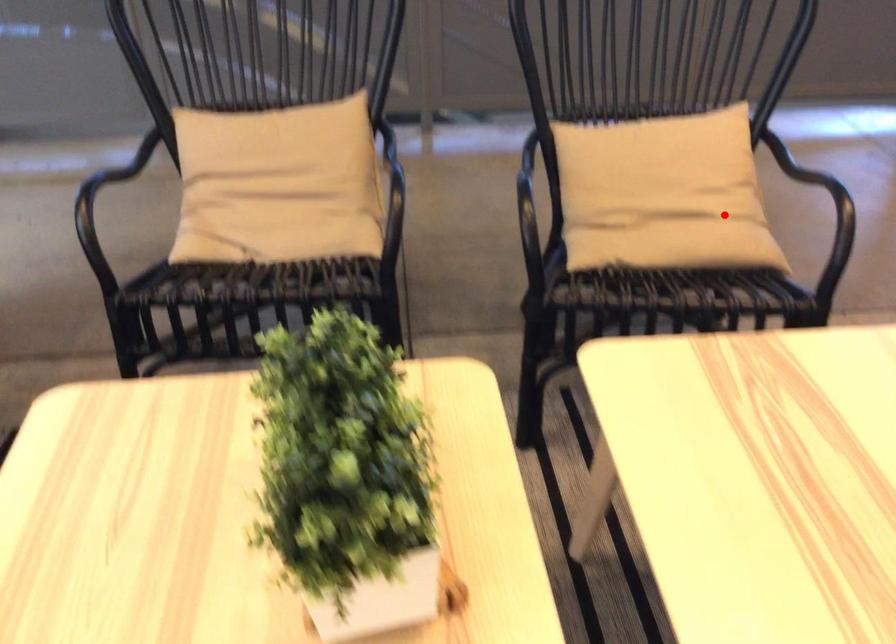
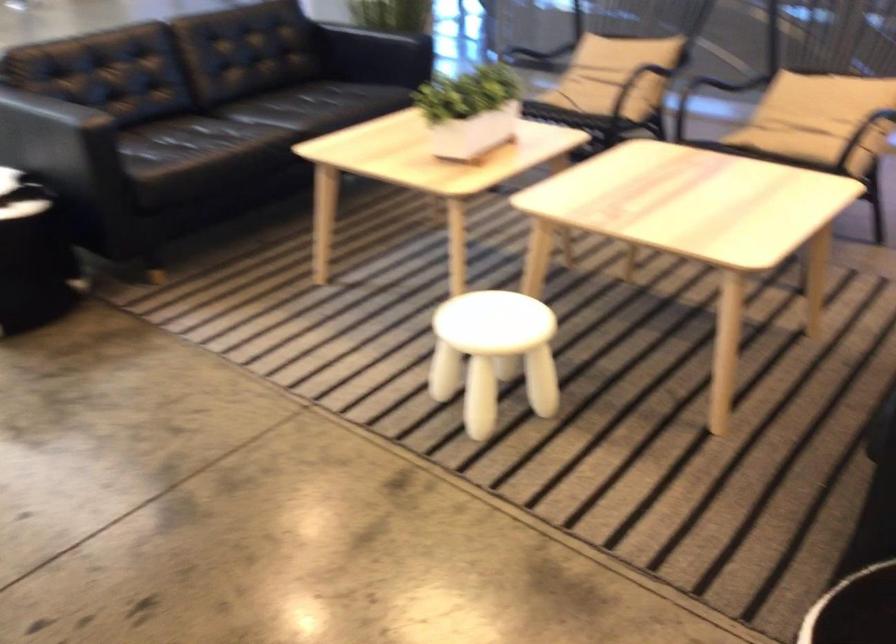
Question: I am providing you with two images of the same scene from different viewpoints. A red point is shown in image1. For the corresponding object point in image2, is it positioned nearer or farther from the camera?

Choices:
 (A) Nearer
 (B) Farther

Answer: (B)